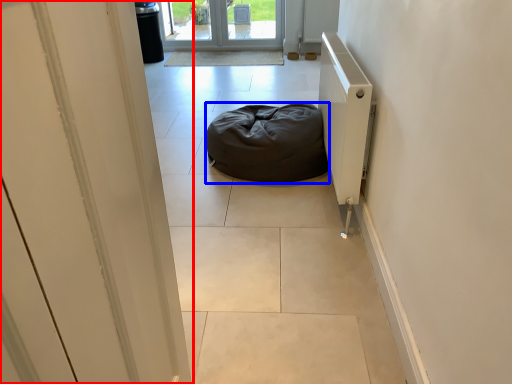
Question: Which object is further to the camera taking this photo, door (highlighted by a red box) or furniture (highlighted by a blue box)?

Choices:
 (A) door
 (B) furniture

Answer: (B)